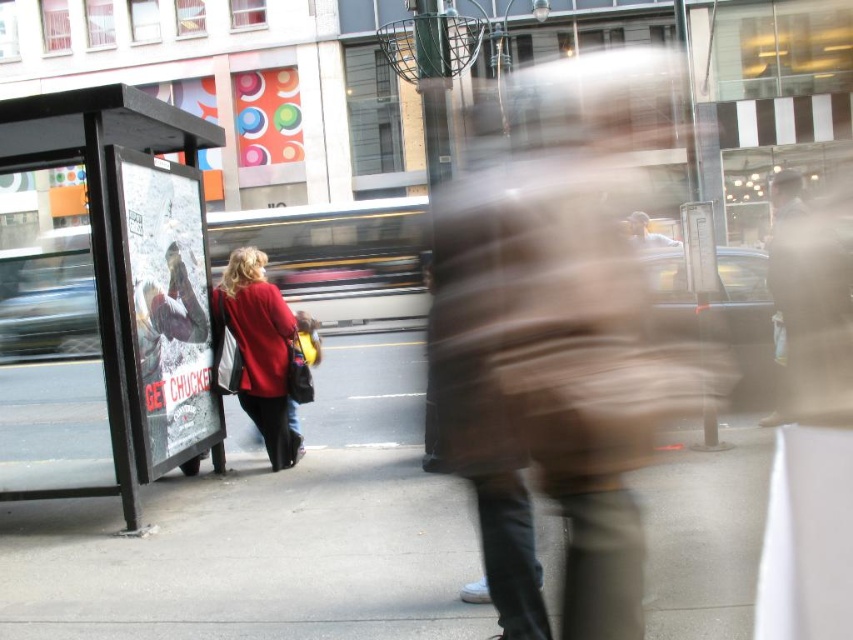
Question: Which is nearer to the brown leather jacket at right?

Choices:
 (A) black plastic bus stop at left
 (B) gray concrete sidewalk at center

Answer: (B)

Question: Is gray concrete sidewalk at center to the left of brown leather jacket at right from the viewer's perspective?

Choices:
 (A) no
 (B) yes

Answer: (B)

Question: Which is farther from the black plastic bus stop at left?

Choices:
 (A) gray concrete sidewalk at center
 (B) brown leather jacket at right

Answer: (B)

Question: Can you confirm if gray concrete sidewalk at center is thinner than matte red coat at center?

Choices:
 (A) yes
 (B) no

Answer: (B)

Question: Which point appears closest to the camera in this image?

Choices:
 (A) (698, 484)
 (B) (16, 497)
 (C) (834, 316)
 (D) (286, 420)

Answer: (B)

Question: Does gray concrete sidewalk at center have a smaller size compared to black plastic bus stop at left?

Choices:
 (A) no
 (B) yes

Answer: (A)